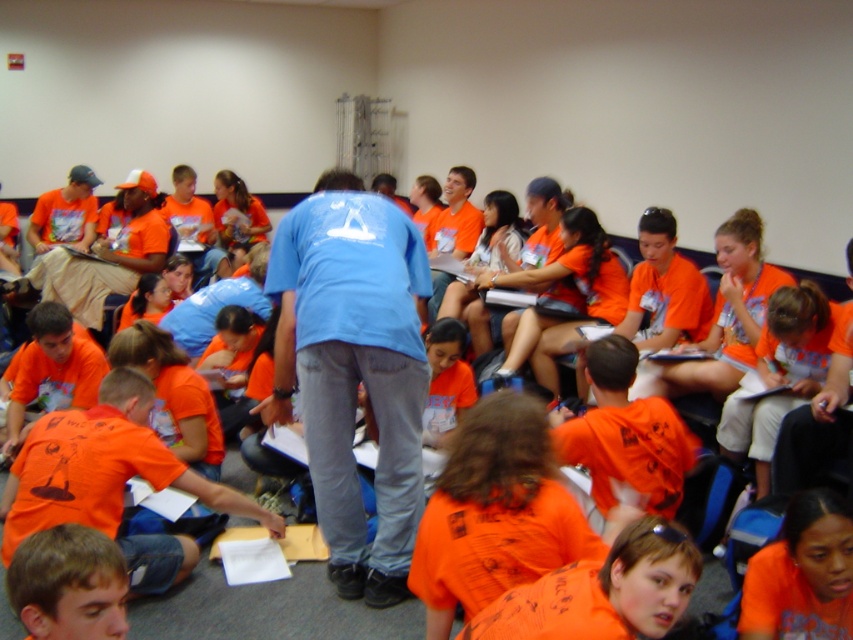
Question: In this image, where is blue cotton shirt at center located relative to orange matte shirt at lower right?

Choices:
 (A) left
 (B) right

Answer: (A)

Question: Can you confirm if blue cotton shirt at center is positioned to the left of orange matte shirt at lower right?

Choices:
 (A) yes
 (B) no

Answer: (A)

Question: Which object appears closest to the camera in this image?

Choices:
 (A) blue cotton shirt at center
 (B) orange matte shirt at lower right

Answer: (B)

Question: Does blue cotton shirt at center have a larger size compared to orange matte shirt at lower right?

Choices:
 (A) no
 (B) yes

Answer: (B)

Question: Which point appears farthest from the camera in this image?

Choices:
 (A) (375, 216)
 (B) (682, 570)

Answer: (A)